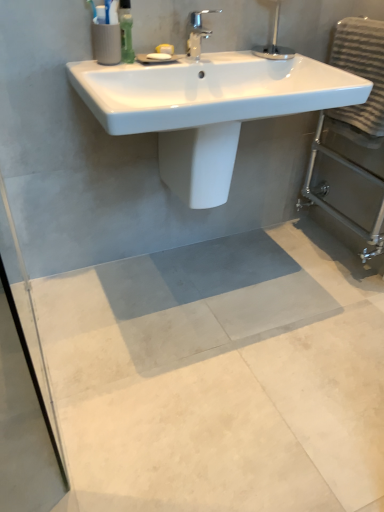
I want to click on vacant space in white glossy bidet at center (from a real-world perspective), so click(x=197, y=264).